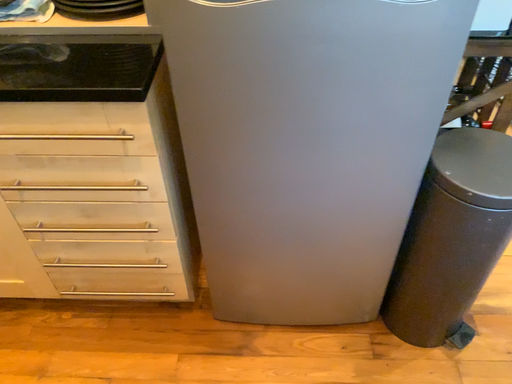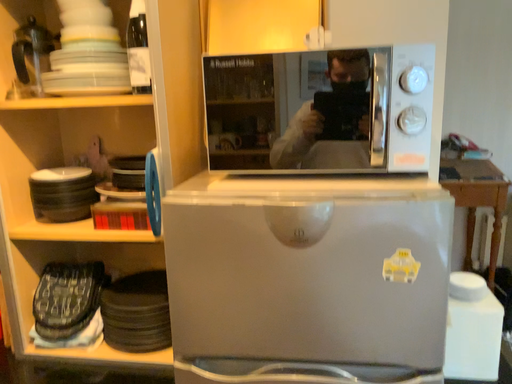
Question: Which way did the camera rotate in the video?

Choices:
 (A) rotated downward
 (B) rotated upward

Answer: (B)